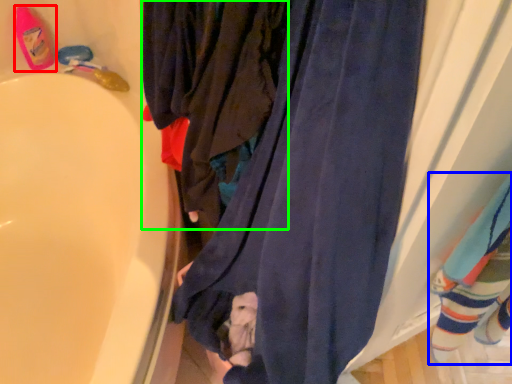
Question: Which object is the closest to the footwear (highlighted by a red box)? Choose among these: bath towel (highlighted by a blue box) or clothing (highlighted by a green box).

Choices:
 (A) bath towel
 (B) clothing

Answer: (B)